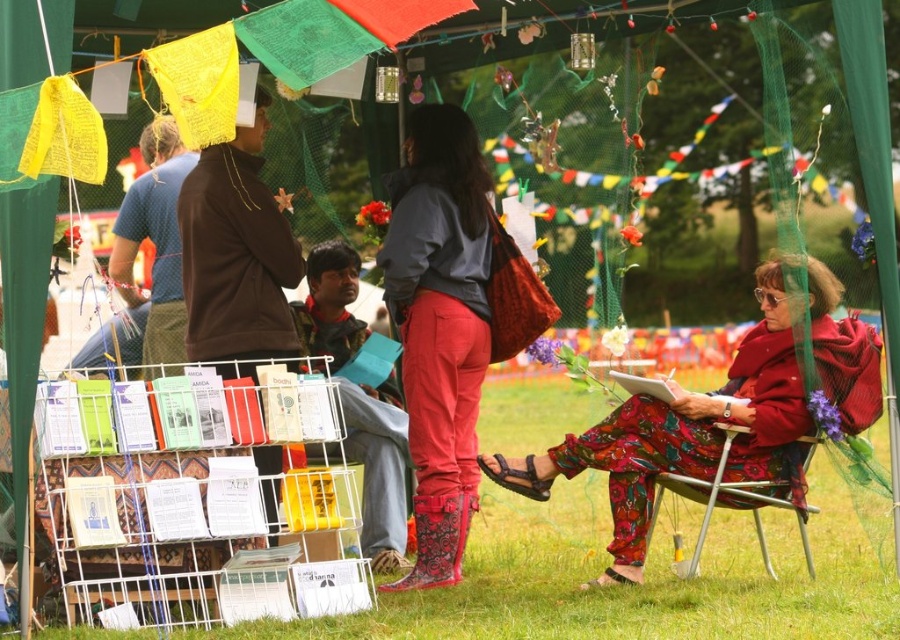
You are organizing a community event and need to place a 4.5 feet wide banner between the rubber boots at center and the metallic silver chair at lower right. Will there be enough space?

The distance between the rubber boots at center and the metallic silver chair at lower right is 5.46 feet, which is greater than the 4.5 feet width of the banner. Therefore, there is enough space to place the banner between them.

You are a visitor at the festival and need to find a place to sit. You see the rubber boots at center and the metallic silver chair at lower right. Which object is closer to the left side of the scene?

The rubber boots at center is to the left of metallic silver chair at lower right, so the rubber boots at center is closer to the left side of the scene.